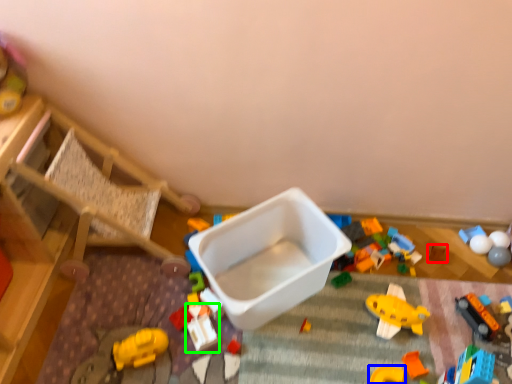
Question: Which object is the farthest from toy (highlighted by a red box)? Choose among these: toy (highlighted by a blue box) or toy (highlighted by a green box).

Choices:
 (A) toy
 (B) toy

Answer: (B)